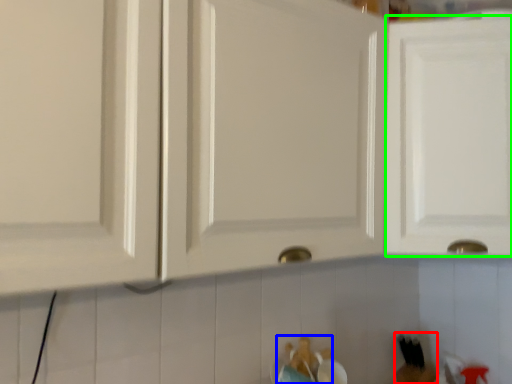
Question: Which object is the farthest from toy (highlighted by a red box)? Choose among these: toy (highlighted by a blue box) or cabinetry (highlighted by a green box).

Choices:
 (A) toy
 (B) cabinetry

Answer: (B)